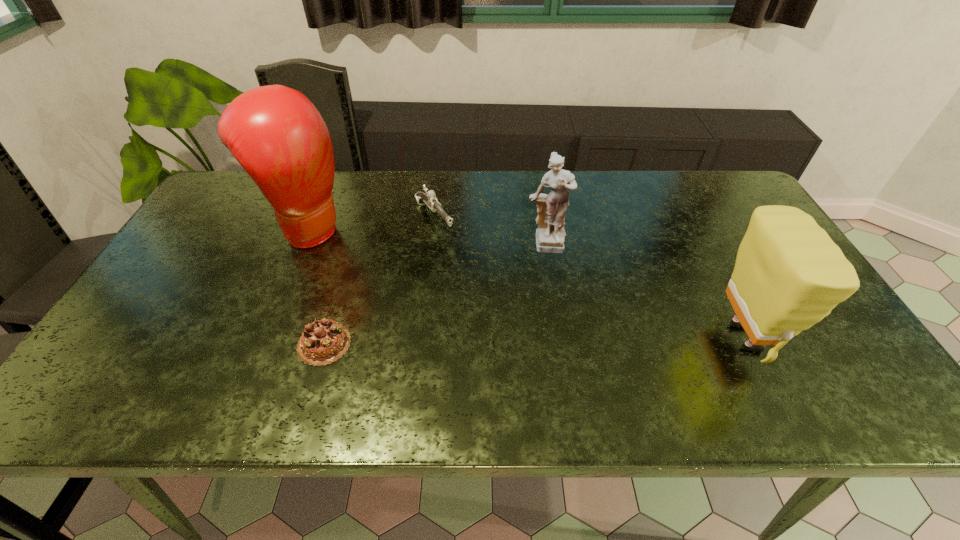
This screenshot has height=540, width=960. In order to click on vacant area situated 0.160m on the front-facing side of the fourth object from left to right in this screenshot , I will do point(555,307).

I want to click on free space located aimed along the barrel of the fourth tallest object, so click(x=491, y=294).

The height and width of the screenshot is (540, 960). In order to click on vacant region located aimed along the barrel of the fourth tallest object in this screenshot , I will do `click(513, 321)`.

This screenshot has height=540, width=960. I want to click on free spot located aimed along the barrel of the fourth tallest object, so [478, 279].

Locate an element on the screen. The image size is (960, 540). vacant region located on the striking surface of the boxing glove is located at coordinates (391, 276).

Identify the location of vacant space situated on the striking surface of the boxing glove. (361, 259).

The width and height of the screenshot is (960, 540). I want to click on free space located 0.150m on the striking surface of the boxing glove, so click(377, 268).

The image size is (960, 540). I want to click on gun located at the far edge, so (429, 198).

This screenshot has width=960, height=540. In order to click on boxing glove located at the far edge in this screenshot , I will do `click(277, 135)`.

You are a GUI agent. You are given a task and a screenshot of the screen. Output one action in this format:
    pyautogui.click(x=<x>, y=<y>)
    Task: Click on the chocolate cake at the near edge
    This screenshot has width=960, height=540.
    Given the screenshot: What is the action you would take?
    pyautogui.click(x=324, y=341)